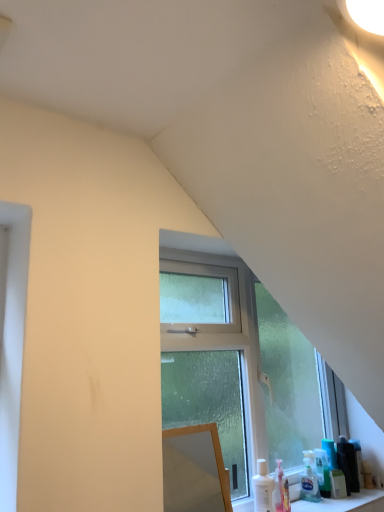
In order to face translucent plastic soap dispenser at lower right, the 1th toiletry viewed from the left, should I rotate leftwards or rightwards?

Turn right approximately 15.255 degrees to face it.

What do you see at coordinates (309, 484) in the screenshot?
I see `translucent plastic soap dispenser at lower right, the 1th toiletry viewed from the left` at bounding box center [309, 484].

This screenshot has width=384, height=512. What do you see at coordinates (235, 366) in the screenshot? I see `clear glass window at center` at bounding box center [235, 366].

The width and height of the screenshot is (384, 512). I want to click on translucent plastic soap dispenser at lower right, which is counted as the 3th toiletry, starting from the right, so click(322, 472).

What is the approximate height of translucent plastic soap dispenser at lower right, the 2th toiletry in the left-to-right sequence?

The height of translucent plastic soap dispenser at lower right, the 2th toiletry in the left-to-right sequence, is 20.66 centimeters.

What do you see at coordinates (358, 460) in the screenshot? I see `matte black hairbrush at lower right, positioned as the 4th toiletry in left-to-right order` at bounding box center [358, 460].

Identify the location of green plastic bottle at lower right, which is the third toiletry from left to right. (348, 464).

Is translucent plastic soap dispenser at lower right, which is counted as the 3th toiletry, starting from the right, facing towards clear glass window at center?

Yes, translucent plastic soap dispenser at lower right, which is counted as the 3th toiletry, starting from the right, faces towards clear glass window at center.

Is translucent plastic soap dispenser at lower right, the 2th toiletry in the left-to-right sequence, positioned beyond the bounds of clear glass window at center?

No, translucent plastic soap dispenser at lower right, the 2th toiletry in the left-to-right sequence, is not entirely external to clear glass window at center.

Which of these two, translucent plastic soap dispenser at lower right, which is counted as the 3th toiletry, starting from the right, or clear glass window at center, is bigger?

clear glass window at center is bigger.

From the image's perspective, between translucent plastic soap dispenser at lower right, the 2th toiletry in the left-to-right sequence, and clear glass window at center, which one is located above?

From the image's view, clear glass window at center is above.

Considering the sizes of clear glass window at center and matte black hairbrush at lower right, the first toiletry viewed from the right, in the image, is clear glass window at center taller or shorter than matte black hairbrush at lower right, the first toiletry viewed from the right,?

Clearly, clear glass window at center is taller compared to matte black hairbrush at lower right, the first toiletry viewed from the right.

From a real-world perspective, is clear glass window at center on matte black hairbrush at lower right, positioned as the 4th toiletry in left-to-right order?

Yes, from a real-world perspective, clear glass window at center is over matte black hairbrush at lower right, positioned as the 4th toiletry in left-to-right order

Is clear glass window at center oriented away from matte black hairbrush at lower right, the first toiletry viewed from the right?

That's right, clear glass window at center is facing away from matte black hairbrush at lower right, the first toiletry viewed from the right.

How different are the orientations of clear glass window at center and matte black hairbrush at lower right, the first toiletry viewed from the right, in degrees?

The angular difference between clear glass window at center and matte black hairbrush at lower right, the first toiletry viewed from the right, is 0.758 degrees.

From the image's perspective, would you say green plastic bottle at lower right, which is the third toiletry from left to right, is shown under clear glass window at center?

Correct, green plastic bottle at lower right, which is the third toiletry from left to right, appears lower than clear glass window at center in the image.

Is green plastic bottle at lower right, which is the third toiletry from left to right, situated inside clear glass window at center or outside?

green plastic bottle at lower right, which is the third toiletry from left to right, is not enclosed by clear glass window at center.

Which object is further away from the camera, green plastic bottle at lower right, which is the third toiletry from left to right, or clear glass window at center?

green plastic bottle at lower right, which is the third toiletry from left to right.

From a real-world perspective, which is physically above, clear glass window at center or green plastic bottle at lower right, which is the third toiletry from left to right?

clear glass window at center.

What's the angular difference between clear glass window at center and green plastic bottle at lower right, positioned as the second toiletry in right-to-left order,'s facing directions?

The angle between the facing direction of clear glass window at center and the facing direction of green plastic bottle at lower right, positioned as the second toiletry in right-to-left order, is 0.759 degrees.

From the image's perspective, is clear glass window at center located above or below green plastic bottle at lower right, which is the third toiletry from left to right?

From the image's perspective, clear glass window at center appears above green plastic bottle at lower right, which is the third toiletry from left to right.

Relative to green plastic bottle at lower right, positioned as the second toiletry in right-to-left order, is clear glass window at center in front or behind?

In the image, clear glass window at center appears in front of green plastic bottle at lower right, positioned as the second toiletry in right-to-left order.

Which object is positioned more to the left, clear glass window at center or wooden mirror at center?

Positioned to the left is wooden mirror at center.

From the image's perspective, which is above, clear glass window at center or wooden mirror at center?

From the image's view, clear glass window at center is above.

From a real-world perspective, who is located lower, clear glass window at center or wooden mirror at center?

In real-world perspective, wooden mirror at center is lower.

Looking at the image, does clear glass window at center seem bigger or smaller compared to wooden mirror at center?

Considering their sizes, clear glass window at center takes up more space than wooden mirror at center.

Considering the relative sizes of matte black hairbrush at lower right, positioned as the 4th toiletry in left-to-right order, and translucent plastic soap dispenser at lower right, the 2th toiletry in the left-to-right sequence, in the image provided, is matte black hairbrush at lower right, positioned as the 4th toiletry in left-to-right order, bigger than translucent plastic soap dispenser at lower right, the 2th toiletry in the left-to-right sequence,?

Actually, matte black hairbrush at lower right, positioned as the 4th toiletry in left-to-right order, might be smaller than translucent plastic soap dispenser at lower right, the 2th toiletry in the left-to-right sequence.

From the picture: Is matte black hairbrush at lower right, the first toiletry viewed from the right, to the left of translucent plastic soap dispenser at lower right, the 2th toiletry in the left-to-right sequence, from the viewer's perspective?

No.

In the scene shown: How much distance is there between matte black hairbrush at lower right, positioned as the 4th toiletry in left-to-right order, and translucent plastic soap dispenser at lower right, which is counted as the 3th toiletry, starting from the right?

The distance of matte black hairbrush at lower right, positioned as the 4th toiletry in left-to-right order, from translucent plastic soap dispenser at lower right, which is counted as the 3th toiletry, starting from the right, is 7.00 inches.

From the image's perspective, who appears lower, matte black hairbrush at lower right, positioned as the 4th toiletry in left-to-right order, or translucent plastic soap dispenser at lower right, the 2th toiletry in the left-to-right sequence?

From the image's view, matte black hairbrush at lower right, positioned as the 4th toiletry in left-to-right order, is below.

Considering the relative positions of green plastic bottle at lower right, positioned as the second toiletry in right-to-left order, and wooden mirror at center in the image provided, is green plastic bottle at lower right, positioned as the second toiletry in right-to-left order, to the left of wooden mirror at center from the viewer's perspective?

Incorrect, green plastic bottle at lower right, positioned as the second toiletry in right-to-left order, is not on the left side of wooden mirror at center.

From a real-world perspective, is green plastic bottle at lower right, positioned as the second toiletry in right-to-left order, positioned over wooden mirror at center based on gravity?

No, from a real-world perspective, green plastic bottle at lower right, positioned as the second toiletry in right-to-left order, is not above wooden mirror at center.

From the image's perspective, which is below, green plastic bottle at lower right, positioned as the second toiletry in right-to-left order, or wooden mirror at center?

From the image's view, green plastic bottle at lower right, positioned as the second toiletry in right-to-left order, is below.

Measure the distance between green plastic bottle at lower right, positioned as the second toiletry in right-to-left order, and wooden mirror at center.

green plastic bottle at lower right, positioned as the second toiletry in right-to-left order, is 1.00 meters from wooden mirror at center.

Locate an element on the screen. The width and height of the screenshot is (384, 512). window located above the translucent plastic soap dispenser at lower right, the 2th toiletry in the left-to-right sequence (from a real-world perspective) is located at coordinates (235, 366).

From a real-world perspective, count 2nd toiletrys downward from the clear glass window at center and point to it. Please provide its 2D coordinates.

[(358, 460)]

When comparing their distances from green plastic bottle at lower right, positioned as the second toiletry in right-to-left order, does clear glass window at center or translucent plastic soap dispenser at lower right, acting as the fourth toiletry starting from the right, seem further?

Among the two, clear glass window at center is located further to green plastic bottle at lower right, positioned as the second toiletry in right-to-left order.

From the image, which object appears to be farther from translucent plastic soap dispenser at lower right, which is counted as the 3th toiletry, starting from the right, wooden mirror at center or translucent plastic soap dispenser at lower right, acting as the fourth toiletry starting from the right?

wooden mirror at center.

Which object lies nearer to the anchor point matte black hairbrush at lower right, positioned as the 4th toiletry in left-to-right order, translucent plastic soap dispenser at lower right, the 1th toiletry viewed from the left, or clear glass window at center?

Among the two, translucent plastic soap dispenser at lower right, the 1th toiletry viewed from the left, is located nearer to matte black hairbrush at lower right, positioned as the 4th toiletry in left-to-right order.

Which object lies further to the anchor point matte black hairbrush at lower right, positioned as the 4th toiletry in left-to-right order, translucent plastic soap dispenser at lower right, acting as the fourth toiletry starting from the right, or wooden mirror at center?

wooden mirror at center is positioned further to the anchor matte black hairbrush at lower right, positioned as the 4th toiletry in left-to-right order.

Looking at the image, which one is located further to wooden mirror at center, translucent plastic soap dispenser at lower right, which is counted as the 3th toiletry, starting from the right, or matte black hairbrush at lower right, the first toiletry viewed from the right?

The object further to wooden mirror at center is matte black hairbrush at lower right, the first toiletry viewed from the right.

Considering their positions, is translucent plastic soap dispenser at lower right, acting as the fourth toiletry starting from the right, positioned further to wooden mirror at center than green plastic bottle at lower right, which is the third toiletry from left to right?

Based on the image, green plastic bottle at lower right, which is the third toiletry from left to right, appears to be further to wooden mirror at center.

Estimate the real-world distances between objects in this image. Which object is closer to clear glass window at center, translucent plastic soap dispenser at lower right, the 1th toiletry viewed from the left, or wooden mirror at center?

wooden mirror at center is closer to clear glass window at center.

Based on their spatial positions, is clear glass window at center or translucent plastic soap dispenser at lower right, the 1th toiletry viewed from the left, further from wooden mirror at center?

translucent plastic soap dispenser at lower right, the 1th toiletry viewed from the left, is positioned further to the anchor wooden mirror at center.

You are a GUI agent. You are given a task and a screenshot of the screen. Output one action in this format:
    pyautogui.click(x=<x>, y=<y>)
    Task: Click on the window situated between wooden mirror at center and translucent plastic soap dispenser at lower right, the 1th toiletry viewed from the left, from left to right
    Image resolution: width=384 pixels, height=512 pixels.
    Given the screenshot: What is the action you would take?
    pyautogui.click(x=235, y=366)

Where is `toiletry between wooden mirror at center and translucent plastic soap dispenser at lower right, which is counted as the 3th toiletry, starting from the right`? The image size is (384, 512). toiletry between wooden mirror at center and translucent plastic soap dispenser at lower right, which is counted as the 3th toiletry, starting from the right is located at coordinates (309, 484).

I want to click on window located between wooden mirror at center and green plastic bottle at lower right, positioned as the second toiletry in right-to-left order, in the left-right direction, so click(x=235, y=366).

Where is `toiletry between translucent plastic soap dispenser at lower right, acting as the fourth toiletry starting from the right, and green plastic bottle at lower right, positioned as the second toiletry in right-to-left order, from left to right`? This screenshot has height=512, width=384. toiletry between translucent plastic soap dispenser at lower right, acting as the fourth toiletry starting from the right, and green plastic bottle at lower right, positioned as the second toiletry in right-to-left order, from left to right is located at coordinates (322, 472).